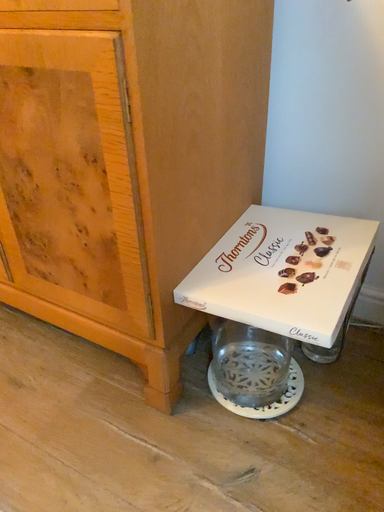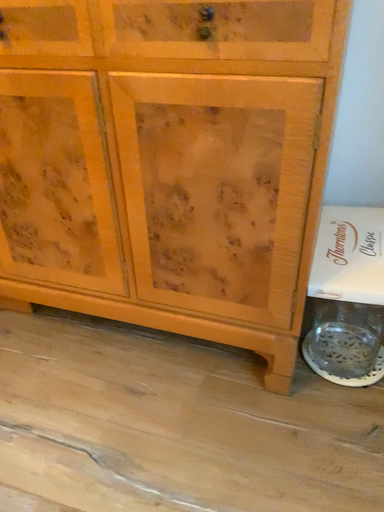
Question: Which way did the camera rotate in the video?

Choices:
 (A) rotated right
 (B) rotated left

Answer: (A)